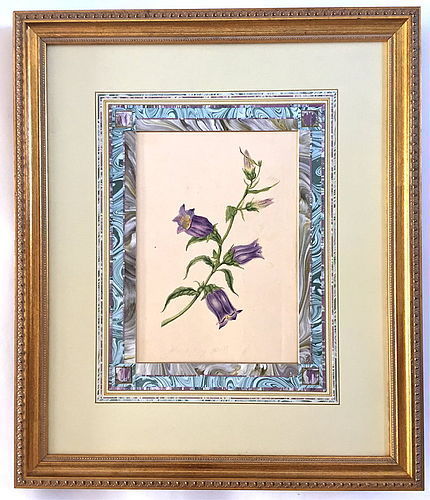
Image resolution: width=430 pixels, height=500 pixels. What are the coordinates of `white wall` in the screenshot? It's located at (6, 363).